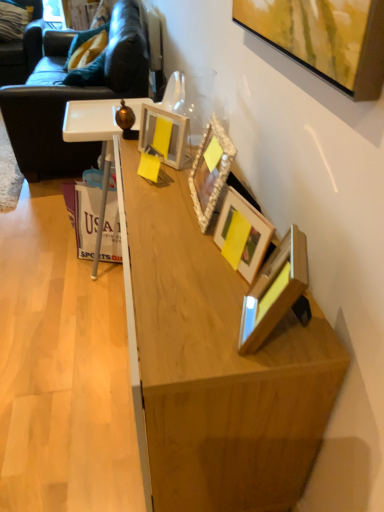
What is the approximate width of wooden picture frame at center, which ranks as the third picture frame in back-to-front order?

The width of wooden picture frame at center, which ranks as the third picture frame in back-to-front order, is 3.18 inches.

What is the approximate width of dark brown leather swivel chair at upper left?

It is 35.76 inches.

What do you see at coordinates (22, 49) in the screenshot? I see `dark brown leather swivel chair at upper left` at bounding box center [22, 49].

Locate an element on the screen. The image size is (384, 512). wooden picture frame at lower right, which appears as the fourth picture frame when viewed from the back is located at coordinates (274, 290).

Where is `dark brown leather couch at left`? This screenshot has width=384, height=512. dark brown leather couch at left is located at coordinates (x=74, y=99).

The image size is (384, 512). Find the location of `silver textured picture frame at upper right, arranged as the third picture frame when viewed from the front`. silver textured picture frame at upper right, arranged as the third picture frame when viewed from the front is located at coordinates (210, 170).

Locate an element on the screen. wooden picture frame at center, which ranks as the third picture frame in back-to-front order is located at coordinates (249, 233).

Considering their positions, is dark brown leather couch at left located in front of or behind matte yellow picture frame at center, the first picture frame when ordered from back to front?

Clearly, dark brown leather couch at left is behind matte yellow picture frame at center, the first picture frame when ordered from back to front.

Which of these two, dark brown leather couch at left or matte yellow picture frame at center, the first picture frame when ordered from back to front, is thinner?

matte yellow picture frame at center, the first picture frame when ordered from back to front, is thinner.

Is dark brown leather couch at left situated inside matte yellow picture frame at center, positioned as the fourth picture frame in front-to-back order, or outside?

dark brown leather couch at left is not inside matte yellow picture frame at center, positioned as the fourth picture frame in front-to-back order, it's outside.

From the picture: From the image's perspective, is dark brown leather couch at left positioned above or below matte yellow picture frame at center, the first picture frame when ordered from back to front?

dark brown leather couch at left is above matte yellow picture frame at center, the first picture frame when ordered from back to front.

This screenshot has height=512, width=384. There is a wooden picture frame at lower right, which appears as the fourth picture frame when viewed from the back. Identify the location of the 2nd picture frame above it (from the image's perspective). (210, 170).

From the image's perspective, does wooden picture frame at lower right, which appears as the fourth picture frame when viewed from the back, appear higher than silver textured picture frame at upper right, the second picture frame in the back-to-front sequence?

Incorrect, from the image's perspective, wooden picture frame at lower right, which appears as the fourth picture frame when viewed from the back, is lower than silver textured picture frame at upper right, the second picture frame in the back-to-front sequence.

Is wooden picture frame at lower right, which appears as the fourth picture frame when viewed from the back, far away from silver textured picture frame at upper right, the second picture frame in the back-to-front sequence?

No, wooden picture frame at lower right, which appears as the fourth picture frame when viewed from the back, is in close proximity to silver textured picture frame at upper right, the second picture frame in the back-to-front sequence.

Considering the sizes of objects wooden picture frame at lower right, which appears as the fourth picture frame when viewed from the back, and silver textured picture frame at upper right, arranged as the third picture frame when viewed from the front, in the image provided, who is smaller, wooden picture frame at lower right, which appears as the fourth picture frame when viewed from the back, or silver textured picture frame at upper right, arranged as the third picture frame when viewed from the front,?

With smaller size is wooden picture frame at lower right, which appears as the fourth picture frame when viewed from the back.

Between natural wood cabinet at center and wooden picture frame at lower right, arranged as the 1th picture frame when viewed from the front, which one has larger width?

natural wood cabinet at center is wider.

Considering the relative positions of natural wood cabinet at center and wooden picture frame at lower right, arranged as the 1th picture frame when viewed from the front, in the image provided, is natural wood cabinet at center to the left of wooden picture frame at lower right, arranged as the 1th picture frame when viewed from the front, from the viewer's perspective?

Yes.

Is natural wood cabinet at center shorter than wooden picture frame at lower right, arranged as the 1th picture frame when viewed from the front?

Indeed, natural wood cabinet at center has a lesser height compared to wooden picture frame at lower right, arranged as the 1th picture frame when viewed from the front.

Does wooden picture frame at center, which ranks as the third picture frame in back-to-front order, touch natural wood cabinet at center?

No, wooden picture frame at center, which ranks as the third picture frame in back-to-front order, is not touching natural wood cabinet at center.

From a real-world perspective, is wooden picture frame at center, which is the 2th picture frame in front-to-back order, above or below natural wood cabinet at center?

From a real-world perspective, wooden picture frame at center, which is the 2th picture frame in front-to-back order, is physically above natural wood cabinet at center.

Considering the sizes of wooden picture frame at center, which is the 2th picture frame in front-to-back order, and natural wood cabinet at center in the image, is wooden picture frame at center, which is the 2th picture frame in front-to-back order, bigger or smaller than natural wood cabinet at center?

Considering their sizes, wooden picture frame at center, which is the 2th picture frame in front-to-back order, takes up less space than natural wood cabinet at center.

Which is closer, (291, 228) or (185, 462)?

The point (185, 462) is closer to the camera.

Which object is thinner, wooden picture frame at lower right, arranged as the 1th picture frame when viewed from the front, or wooden desk at center?

wooden picture frame at lower right, arranged as the 1th picture frame when viewed from the front.

From the image's perspective, which one is positioned higher, wooden picture frame at lower right, which appears as the fourth picture frame when viewed from the back, or wooden desk at center?

wooden picture frame at lower right, which appears as the fourth picture frame when viewed from the back, is shown above in the image.

Could you measure the distance between wooden picture frame at lower right, arranged as the 1th picture frame when viewed from the front, and wooden desk at center?

8.95 inches.

Is wooden picture frame at lower right, which appears as the fourth picture frame when viewed from the back, smaller than matte yellow picture frame at center, positioned as the fourth picture frame in front-to-back order?

Yes.

From a real-world perspective, is wooden picture frame at lower right, which appears as the fourth picture frame when viewed from the back, over matte yellow picture frame at center, positioned as the fourth picture frame in front-to-back order?

Yes.

Which of these two, wooden picture frame at lower right, arranged as the 1th picture frame when viewed from the front, or matte yellow picture frame at center, the first picture frame when ordered from back to front, is wider?

With larger width is matte yellow picture frame at center, the first picture frame when ordered from back to front.

Considering the relative positions of wooden picture frame at center, which ranks as the third picture frame in back-to-front order, and wooden desk at center in the image provided, is wooden picture frame at center, which ranks as the third picture frame in back-to-front order, to the left of wooden desk at center from the viewer's perspective?

Incorrect, wooden picture frame at center, which ranks as the third picture frame in back-to-front order, is not on the left side of wooden desk at center.

From the image's perspective, would you say wooden picture frame at center, which is the 2th picture frame in front-to-back order, is shown under wooden desk at center?

No, from the image's perspective, wooden picture frame at center, which is the 2th picture frame in front-to-back order, is not beneath wooden desk at center.

Is point (226, 217) positioned in front of point (204, 392)?

No, (226, 217) is behind (204, 392).

Based on the photo, considering the sizes of wooden picture frame at center, which ranks as the third picture frame in back-to-front order, and wooden desk at center in the image, is wooden picture frame at center, which ranks as the third picture frame in back-to-front order, bigger or smaller than wooden desk at center?

In the image, wooden picture frame at center, which ranks as the third picture frame in back-to-front order, appears to be smaller than wooden desk at center.

Image resolution: width=384 pixels, height=512 pixels. I want to click on studio couch behind the matte yellow picture frame at center, the first picture frame when ordered from back to front, so point(74,99).

Identify the location of picture frame that is the 2nd object to the left of the wooden picture frame at lower right, which appears as the fourth picture frame when viewed from the back, starting at the anchor. (210, 170).

From the picture: Estimate the real-world distances between objects in this image. Which object is closer to matte yellow picture frame at center, positioned as the fourth picture frame in front-to-back order, dark brown leather swivel chair at upper left or dark brown leather couch at left?

Among the two, dark brown leather couch at left is located nearer to matte yellow picture frame at center, positioned as the fourth picture frame in front-to-back order.

From the image, which object appears to be nearer to silver textured picture frame at upper right, arranged as the third picture frame when viewed from the front, natural wood cabinet at center or dark brown leather couch at left?

Based on the image, natural wood cabinet at center appears to be nearer to silver textured picture frame at upper right, arranged as the third picture frame when viewed from the front.

When comparing their distances from wooden picture frame at center, which ranks as the third picture frame in back-to-front order, does wooden picture frame at lower right, arranged as the 1th picture frame when viewed from the front, or natural wood cabinet at center seem closer?

wooden picture frame at lower right, arranged as the 1th picture frame when viewed from the front, lies closer to wooden picture frame at center, which ranks as the third picture frame in back-to-front order, than the other object.

Estimate the real-world distances between objects in this image. Which object is closer to wooden picture frame at lower right, arranged as the 1th picture frame when viewed from the front, dark brown leather swivel chair at upper left or wooden picture frame at center, which is the 2th picture frame in front-to-back order?

Among the two, wooden picture frame at center, which is the 2th picture frame in front-to-back order, is located nearer to wooden picture frame at lower right, arranged as the 1th picture frame when viewed from the front.

From the image, which object appears to be farther from silver textured picture frame at upper right, the second picture frame in the back-to-front sequence, dark brown leather swivel chair at upper left or dark brown leather couch at left?

dark brown leather swivel chair at upper left is further to silver textured picture frame at upper right, the second picture frame in the back-to-front sequence.

From the image, which object appears to be nearer to silver textured picture frame at upper right, arranged as the third picture frame when viewed from the front, wooden picture frame at lower right, which appears as the fourth picture frame when viewed from the back, or wooden picture frame at center, which is the 2th picture frame in front-to-back order?

Among the two, wooden picture frame at center, which is the 2th picture frame in front-to-back order, is located nearer to silver textured picture frame at upper right, arranged as the third picture frame when viewed from the front.

From the image, which object appears to be nearer to wooden picture frame at lower right, which appears as the fourth picture frame when viewed from the back, dark brown leather couch at left or silver textured picture frame at upper right, the second picture frame in the back-to-front sequence?

Based on the image, silver textured picture frame at upper right, the second picture frame in the back-to-front sequence, appears to be nearer to wooden picture frame at lower right, which appears as the fourth picture frame when viewed from the back.

In the scene shown: Based on their spatial positions, is wooden desk at center or wooden picture frame at lower right, which appears as the fourth picture frame when viewed from the back, closer to dark brown leather couch at left?

wooden desk at center is closer to dark brown leather couch at left.

Where is `plywood between wooden picture frame at center, which ranks as the third picture frame in back-to-front order, and dark brown leather swivel chair at upper left in the front-back direction`? This screenshot has height=512, width=384. plywood between wooden picture frame at center, which ranks as the third picture frame in back-to-front order, and dark brown leather swivel chair at upper left in the front-back direction is located at coordinates (62, 369).

Find the location of a particular element. plywood between wooden desk at center and dark brown leather swivel chair at upper left along the z-axis is located at coordinates (62, 369).

Locate an element on the screen. The image size is (384, 512). picture frame between silver textured picture frame at upper right, arranged as the third picture frame when viewed from the front, and dark brown leather swivel chair at upper left from front to back is located at coordinates (169, 136).

Locate an element on the screen. desk located between natural wood cabinet at center and wooden picture frame at center, which is the 2th picture frame in front-to-back order, in the left-right direction is located at coordinates (213, 365).